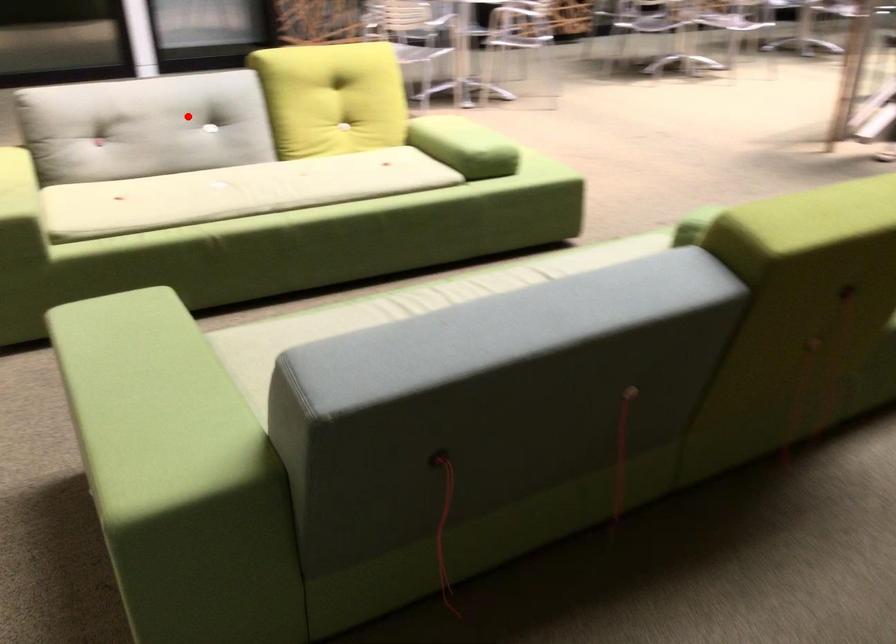
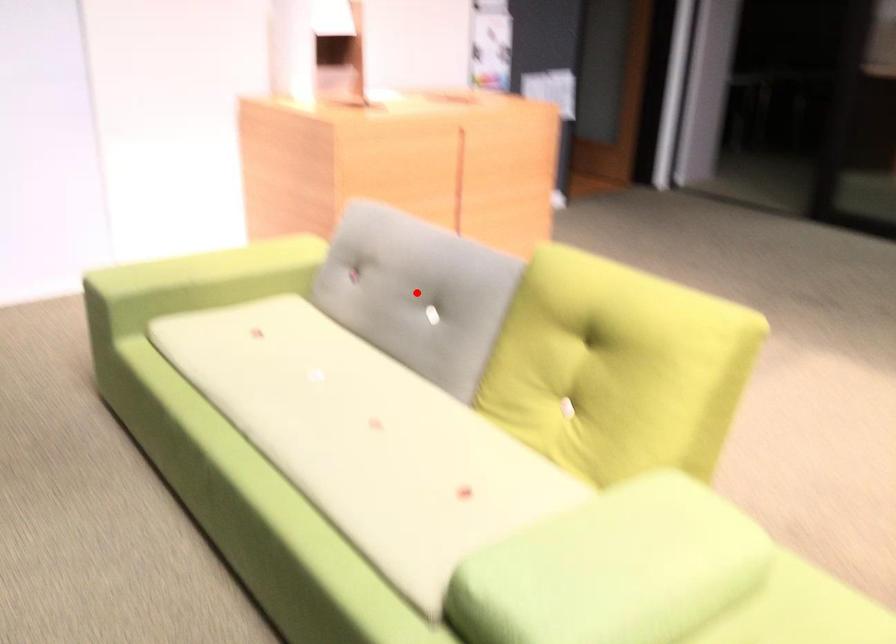
I am providing you with two images of the same scene from different viewpoints. A red point is marked on the first image and another point is marked on the second image. Do the highlighted points in image1 and image2 indicate the same real-world spot?

Yes